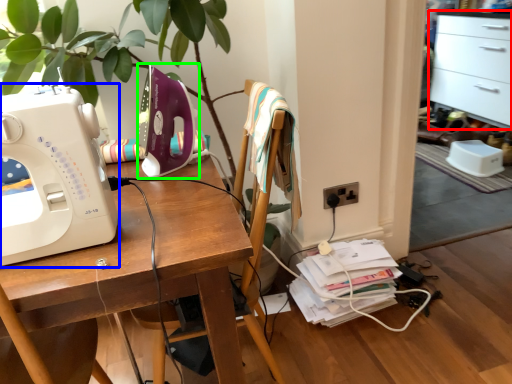
Question: Estimate the real-world distances between objects in this image. Which object is closer to file cabinet (highlighted by a red box), sewing machine (highlighted by a blue box) or sewing machine (highlighted by a green box)?

Choices:
 (A) sewing machine
 (B) sewing machine

Answer: (B)